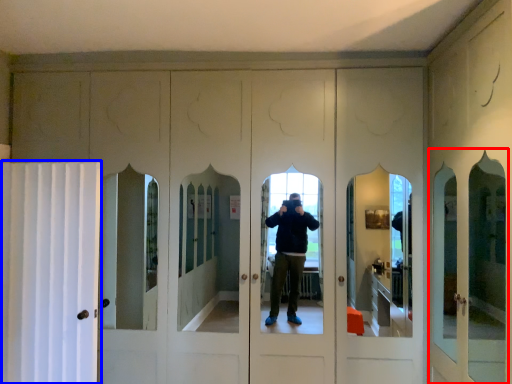
Question: Which object is closer to the camera taking this photo, screen door (highlighted by a red box) or curtain (highlighted by a blue box)?

Choices:
 (A) screen door
 (B) curtain

Answer: (A)